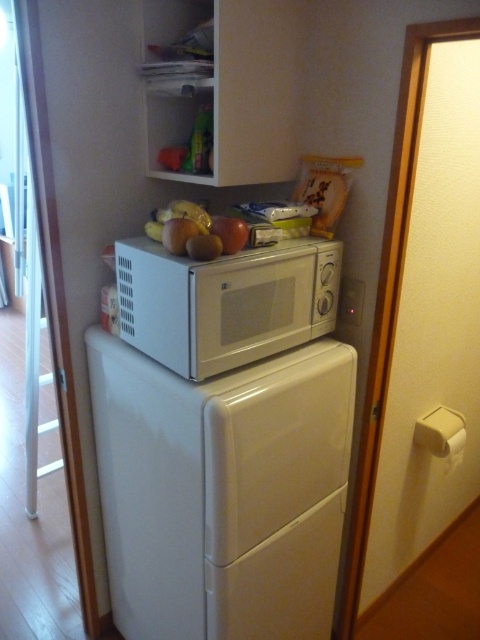
Between yellow matte apple at upper center and matte yellow apple at center, which one appears on the left side from the viewer's perspective?

From the viewer's perspective, yellow matte apple at upper center appears more on the left side.

What do you see at coordinates (179, 234) in the screenshot?
I see `yellow matte apple at upper center` at bounding box center [179, 234].

What do you see at coordinates (179, 234) in the screenshot? I see `yellow matte apple at upper center` at bounding box center [179, 234].

The width and height of the screenshot is (480, 640). In order to click on yellow matte apple at upper center in this screenshot , I will do `click(179, 234)`.

Who is higher up, yellow matte apple at upper center or matte red apple at center?

yellow matte apple at upper center

Describe the element at coordinates (179, 234) in the screenshot. Image resolution: width=480 pixels, height=640 pixels. I see `yellow matte apple at upper center` at that location.

The image size is (480, 640). Identify the location of yellow matte apple at upper center. (179, 234).

Between point (241, 534) and point (240, 282), which one is positioned in front?

Point (240, 282)

Does white glossy refrigerator at center appear on the right side of white matte microwave at center?

No, white glossy refrigerator at center is not to the right of white matte microwave at center.

This screenshot has height=640, width=480. What are the coordinates of `white glossy refrigerator at center` in the screenshot? It's located at (223, 492).